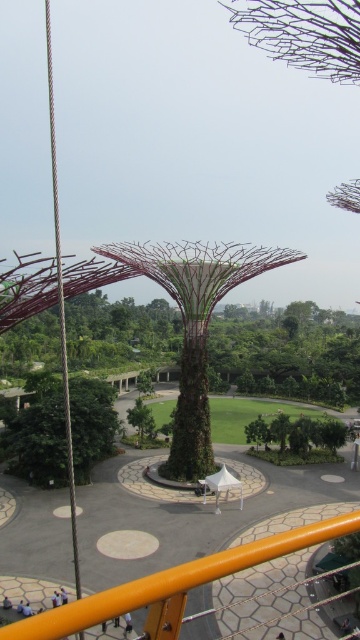
Question: Is the position of green grassy field at center more distant than that of green textured tree at center?

Choices:
 (A) no
 (B) yes

Answer: (A)

Question: Is green textured tree at lower left to the right of green grassy field at center from the viewer's perspective?

Choices:
 (A) no
 (B) yes

Answer: (A)

Question: Which is farther from the green grassy field at center?

Choices:
 (A) green textured tree at lower left
 (B) green textured tree at center

Answer: (A)

Question: Observing the image, what is the correct spatial positioning of green textured tree at lower left in reference to green textured tree at center?

Choices:
 (A) below
 (B) above

Answer: (B)

Question: Among these points, which one is farthest from the camera?

Choices:
 (A) (217, 420)
 (B) (137, 401)

Answer: (A)

Question: Considering the real-world distances, which object is closest to the green grassy field at center?

Choices:
 (A) green textured tree at center
 (B) green textured tree at lower left

Answer: (A)